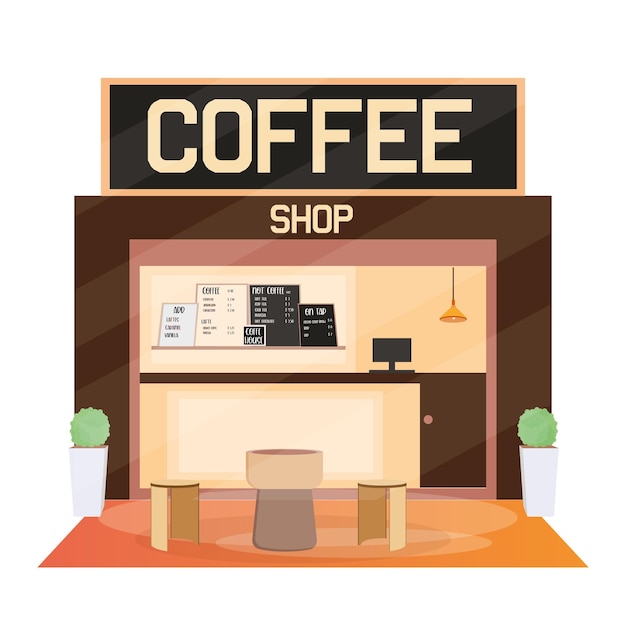
Locate an element on the screen. plant holders is located at coordinates (533, 484), (96, 480).